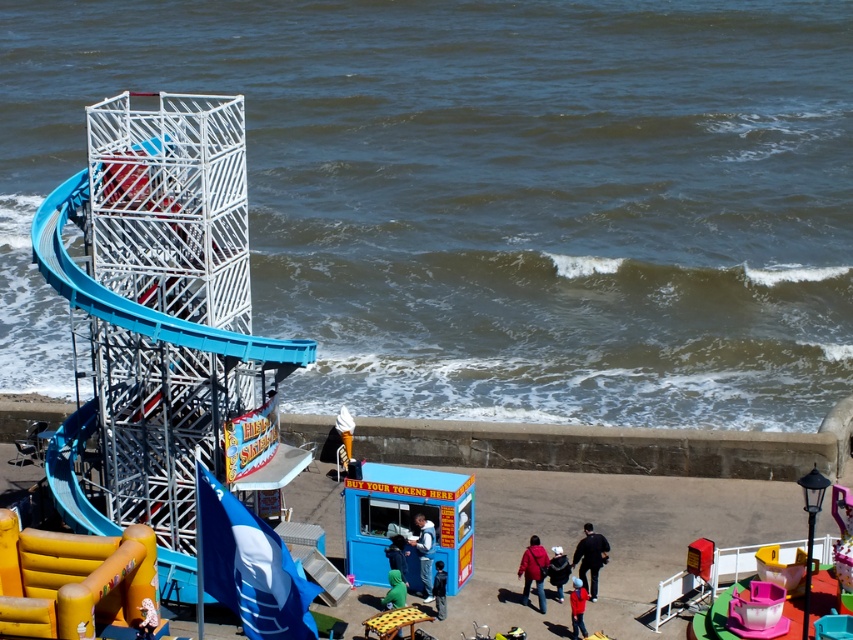
Question: Which of these objects is positioned farthest from the pink fabric teddy bear at center?

Choices:
 (A) dark blue jacket at lower center
 (B) yellow inflatable slide at lower left
 (C) dark blue jacket at center
 (D) green fabric at lower center

Answer: (C)

Question: Does yellow inflatable slide at lower left appear on the right side of dark blue fabric jacket at lower center?

Choices:
 (A) yes
 (B) no

Answer: (B)

Question: Can you confirm if dark blue fabric jacket at lower center is positioned below dark blue jacket at center?

Choices:
 (A) no
 (B) yes

Answer: (A)

Question: Which is nearer to the yellow inflatable slide at lower left?

Choices:
 (A) pink fabric teddy bear at center
 (B) dark blue fabric jacket at lower center

Answer: (A)

Question: Can you confirm if dark blue fabric jacket at lower center is positioned below green fabric at lower center?

Choices:
 (A) yes
 (B) no

Answer: (B)

Question: Which of the following is the farthest from the observer?

Choices:
 (A) dark blue fabric jacket at lower center
 (B) white cotton hoodie at center

Answer: (A)